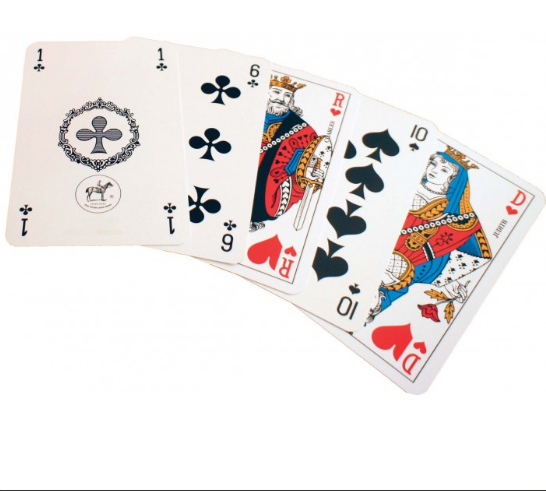
Find the location of a particular element. playing cards is located at coordinates coord(90,137), coord(200,139), coord(287,157), coord(357,191), coord(441,256).